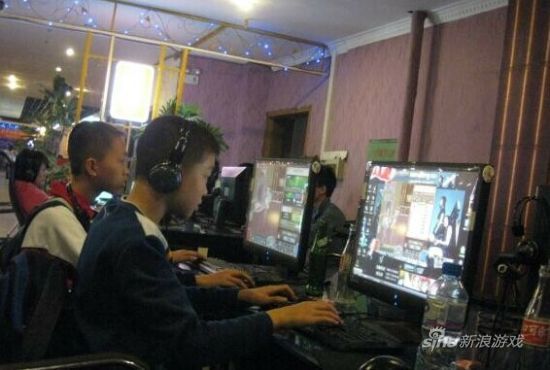
The height and width of the screenshot is (370, 550). I want to click on doorway, so pyautogui.click(x=290, y=136).